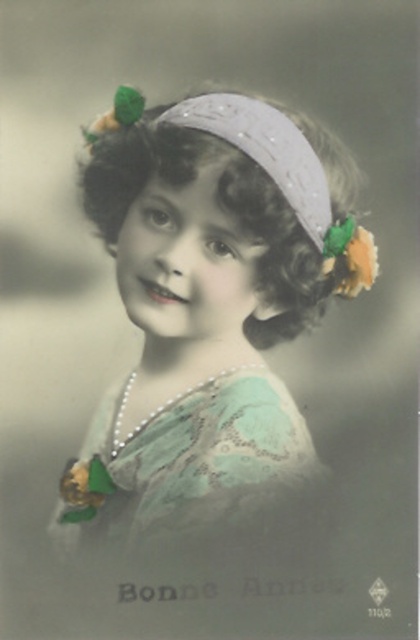
Is lace fabric dress at center smaller than white sequined headband at center?

Actually, lace fabric dress at center might be larger than white sequined headband at center.

Is point (139, 483) closer to camera compared to point (259, 150)?

No, it is not.

The width and height of the screenshot is (420, 640). What are the coordinates of `lace fabric dress at center` in the screenshot? It's located at (194, 465).

Is curly brown hair at center smaller than green shiny flower at upper right?

No, curly brown hair at center is not smaller than green shiny flower at upper right.

Is curly brown hair at center below green shiny flower at upper right?

No, curly brown hair at center is not below green shiny flower at upper right.

Where is `curly brown hair at center`? The image size is (420, 640). curly brown hair at center is located at coordinates (243, 193).

Can you confirm if matte green dress at center is bigger than white sequined headband at center?

Yes, matte green dress at center is bigger than white sequined headband at center.

Is matte green dress at center below white sequined headband at center?

Yes.

Which is behind, point (131, 376) or point (322, 196)?

The point (131, 376) is behind.

The image size is (420, 640). I want to click on matte green dress at center, so click(x=204, y=307).